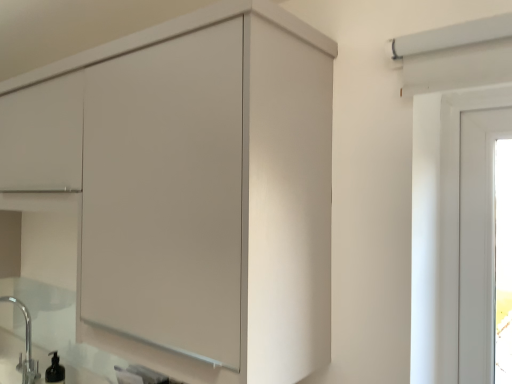
Question: Is the position of matte white cupboard at center more distant than that of satin nickel faucet at lower left?

Choices:
 (A) yes
 (B) no

Answer: (B)

Question: Considering the relative positions of matte white cupboard at center and satin nickel faucet at lower left in the image provided, is matte white cupboard at center in front of satin nickel faucet at lower left?

Choices:
 (A) yes
 (B) no

Answer: (A)

Question: Does matte white cupboard at center have a greater height compared to satin nickel faucet at lower left?

Choices:
 (A) yes
 (B) no

Answer: (A)

Question: Does matte white cupboard at center have a lesser height compared to satin nickel faucet at lower left?

Choices:
 (A) yes
 (B) no

Answer: (B)

Question: Is matte white cupboard at center outside of satin nickel faucet at lower left?

Choices:
 (A) yes
 (B) no

Answer: (A)

Question: Could you tell me if matte white cupboard at center is turned towards satin nickel faucet at lower left?

Choices:
 (A) no
 (B) yes

Answer: (A)

Question: Can you confirm if satin nickel faucet at lower left is thinner than matte white cupboard at center?

Choices:
 (A) yes
 (B) no

Answer: (A)

Question: From a real-world perspective, is satin nickel faucet at lower left on top of matte white cupboard at center?

Choices:
 (A) yes
 (B) no

Answer: (B)

Question: Can you confirm if satin nickel faucet at lower left is positioned to the left of matte white cupboard at center?

Choices:
 (A) yes
 (B) no

Answer: (A)

Question: Is satin nickel faucet at lower left oriented towards matte white cupboard at center?

Choices:
 (A) yes
 (B) no

Answer: (B)

Question: Does satin nickel faucet at lower left have a greater width compared to matte white cupboard at center?

Choices:
 (A) yes
 (B) no

Answer: (B)

Question: Can you confirm if satin nickel faucet at lower left is taller than matte white cupboard at center?

Choices:
 (A) yes
 (B) no

Answer: (B)

Question: Is point (27, 377) positioned closer to the camera than point (229, 185)?

Choices:
 (A) closer
 (B) farther

Answer: (B)